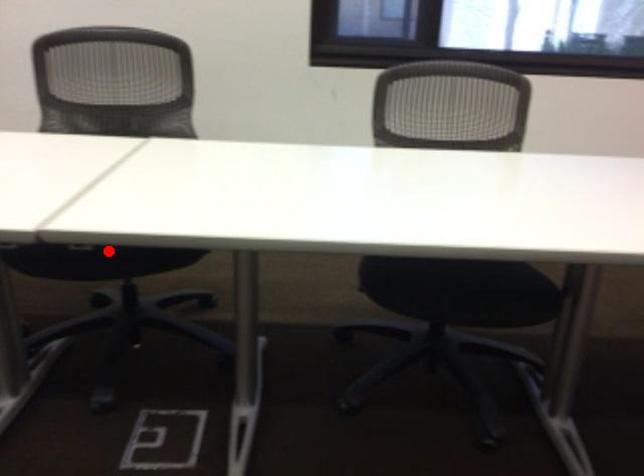
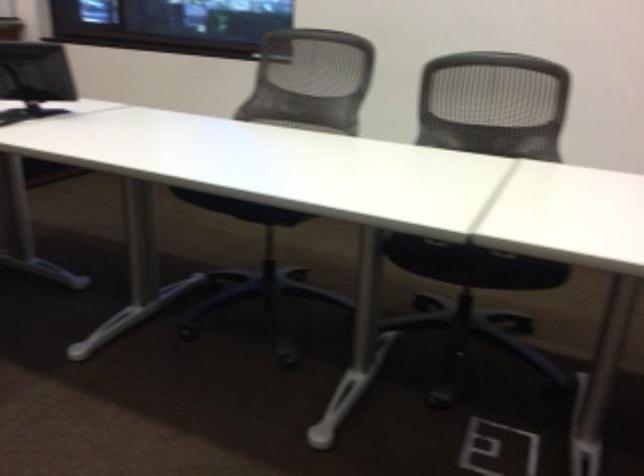
In the second image, find the point that corresponds to the highlighted location in the first image.

(471, 264)